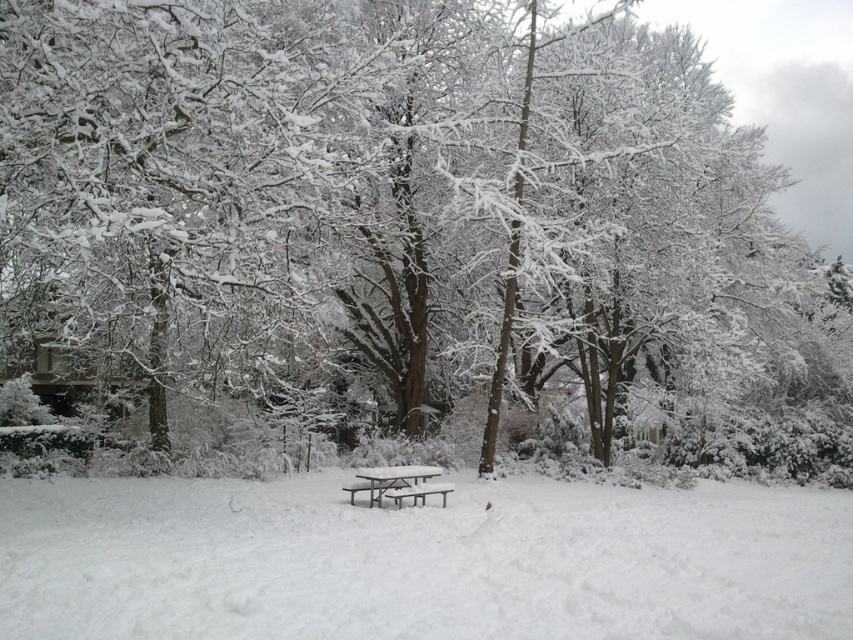
Question: Can you confirm if white matte snow at center is positioned above white plastic picnic table at center?

Choices:
 (A) yes
 (B) no

Answer: (B)

Question: Is white matte snow at center thinner than metallic silver bench at center?

Choices:
 (A) no
 (B) yes

Answer: (A)

Question: From the image, what is the correct spatial relationship of white plastic picnic table at center in relation to metallic silver bench at center?

Choices:
 (A) below
 (B) above

Answer: (B)

Question: Among these points, which one is nearest to the camera?

Choices:
 (A) (584, 564)
 (B) (427, 493)

Answer: (A)

Question: Which point is farther to the camera?

Choices:
 (A) (451, 499)
 (B) (450, 483)
 (C) (424, 492)

Answer: (B)

Question: Among these points, which one is farthest from the camera?

Choices:
 (A) (395, 497)
 (B) (223, 516)

Answer: (A)